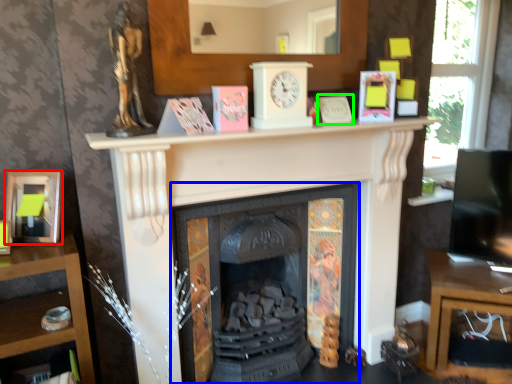
Question: Which is nearer to the picture frame (highlighted by a red box)? fireplace (highlighted by a blue box) or paperback book (highlighted by a green box).

Choices:
 (A) fireplace
 (B) paperback book

Answer: (A)